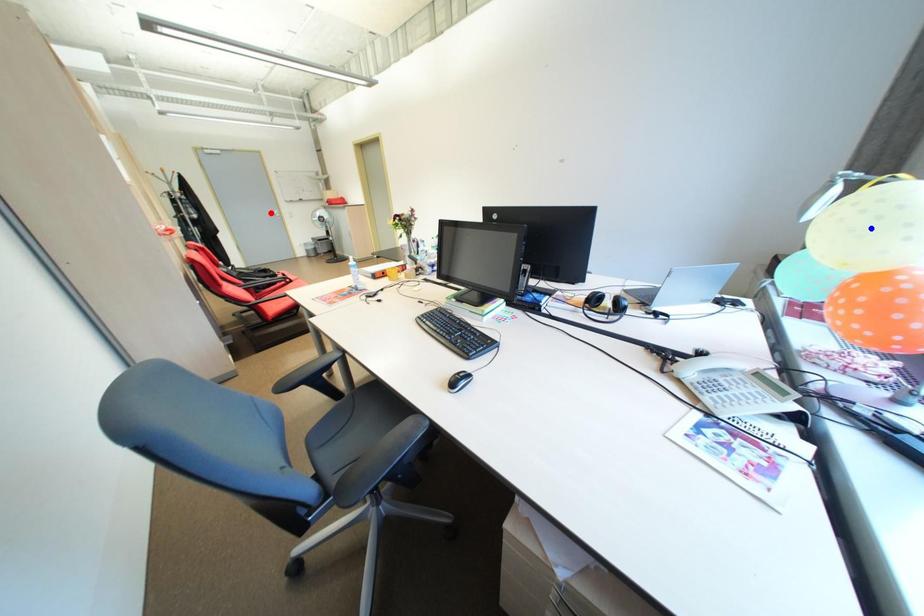
Question: Two points are marked on the image. Which point is closer to the camera?

Choices:
 (A) Blue point is closer.
 (B) Red point is closer.

Answer: (A)